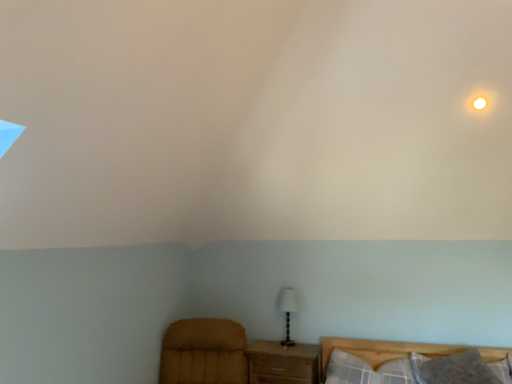
You are a GUI agent. You are given a task and a screenshot of the screen. Output one action in this format:
    pyautogui.click(x=<x>, y=<y>)
    Task: Click on the vacant region to the right of white fabric lampshade at center
    This screenshot has height=384, width=512.
    Given the screenshot: What is the action you would take?
    pyautogui.click(x=308, y=348)